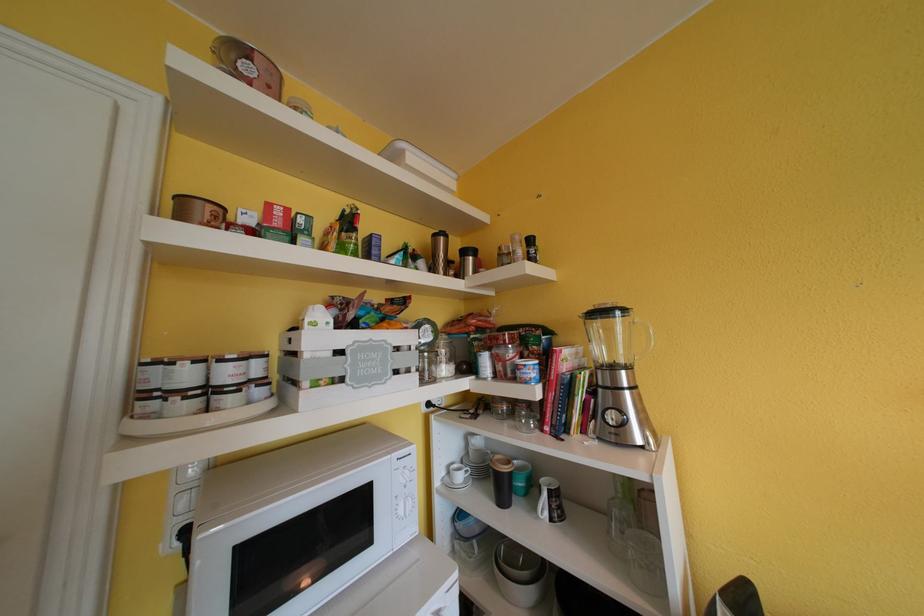
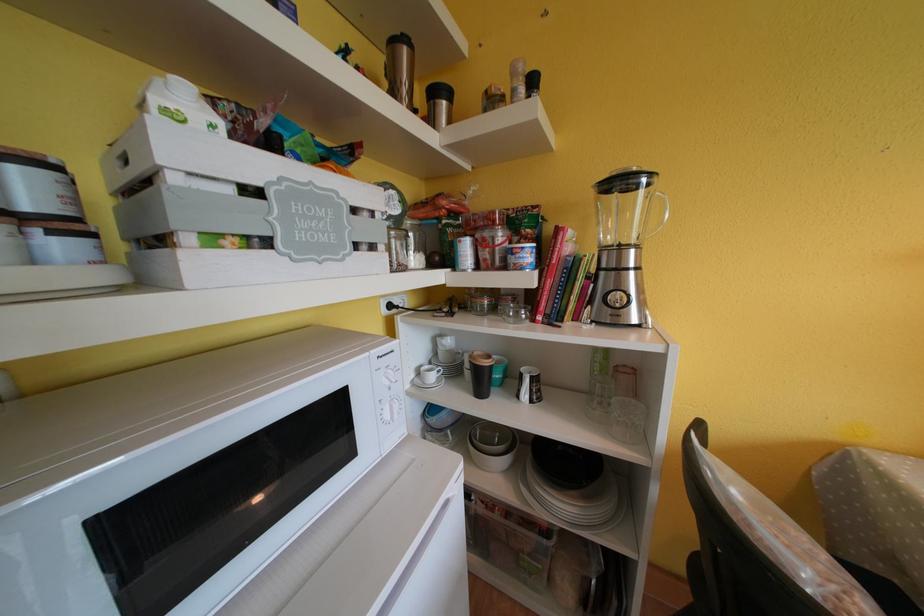
Find the pixel in the second image that matches point 553,517 in the first image.

(533, 400)